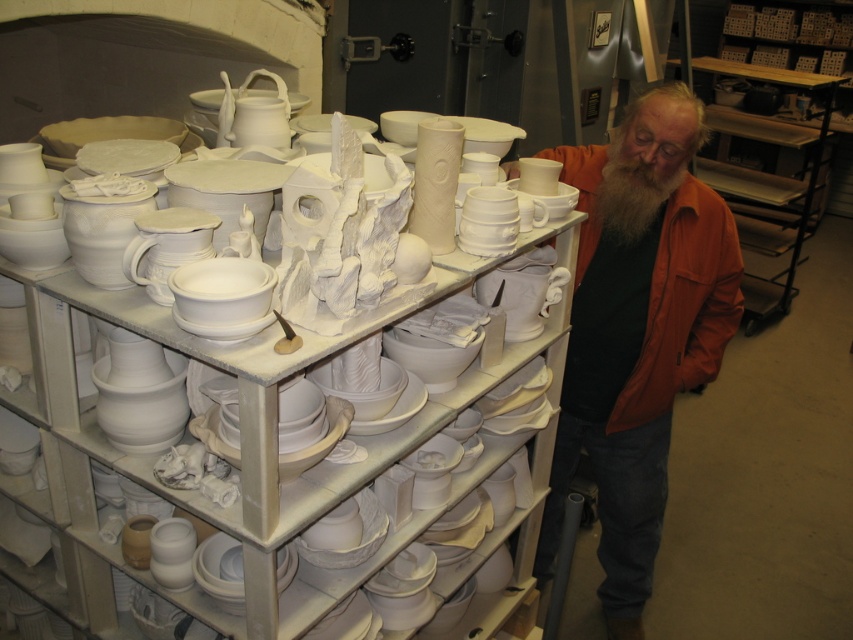
Question: In this image, where is orange leather jacket at right located relative to white matte beard at center?

Choices:
 (A) below
 (B) above

Answer: (A)

Question: Does orange leather jacket at right appear over white matte beard at center?

Choices:
 (A) yes
 (B) no

Answer: (B)

Question: Which point is closer to the camera?

Choices:
 (A) white matte beard at center
 (B) orange leather jacket at right

Answer: (B)

Question: Does wooden at right appear under white matte beard at center?

Choices:
 (A) no
 (B) yes

Answer: (A)

Question: Among these points, which one is nearest to the camera?

Choices:
 (A) (691, 371)
 (B) (15, 401)

Answer: (B)

Question: Which point is farther to the camera?

Choices:
 (A) (650, 188)
 (B) (323, 326)
 (C) (715, 200)

Answer: (C)